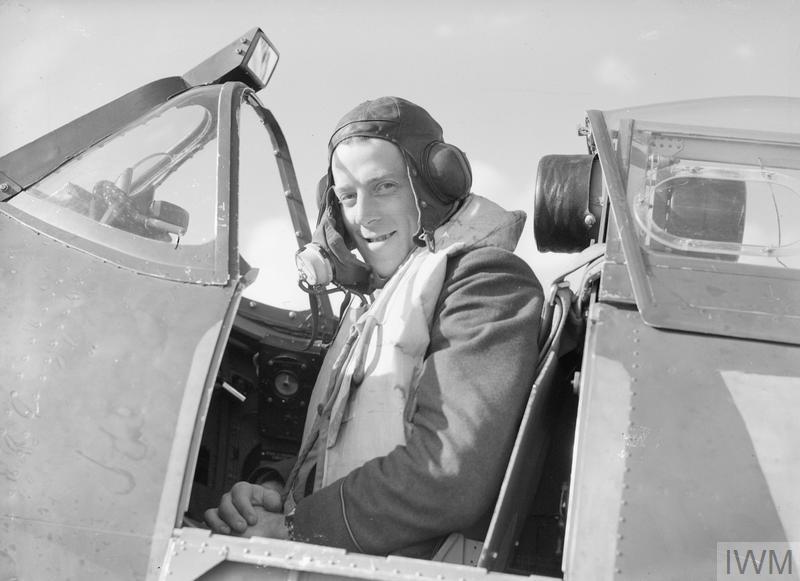
Where is `mirror`? Image resolution: width=800 pixels, height=581 pixels. mirror is located at coordinates (256, 60).